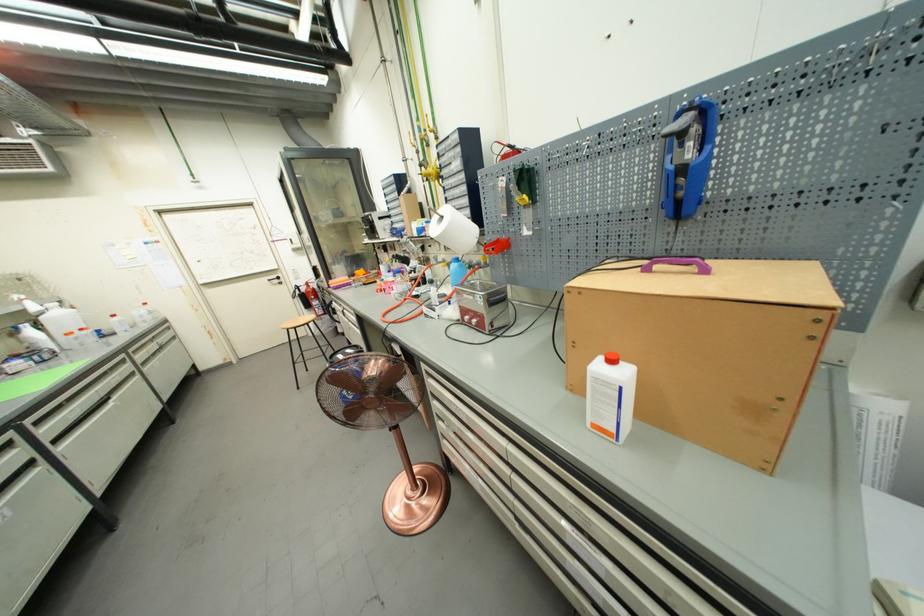
Describe the element at coordinates (456, 270) in the screenshot. Image resolution: width=924 pixels, height=616 pixels. I see `the blue plastic bottle` at that location.